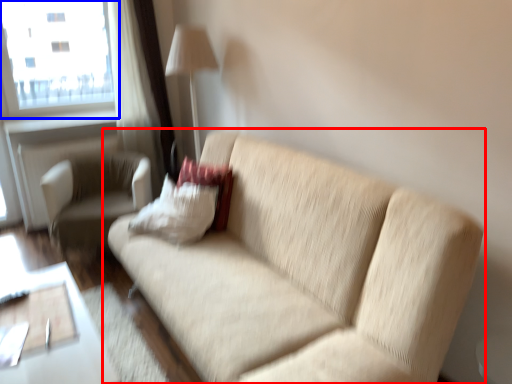
Question: Which point is closer to the camera, studio couch (highlighted by a red box) or window (highlighted by a blue box)?

Choices:
 (A) studio couch
 (B) window

Answer: (A)